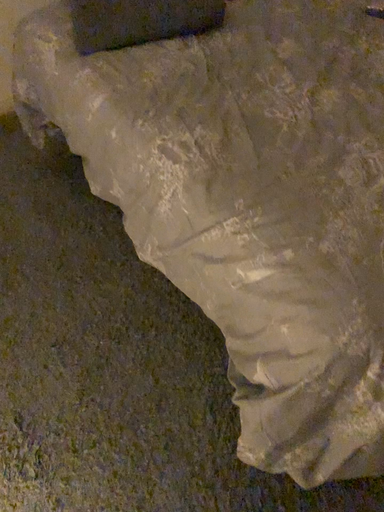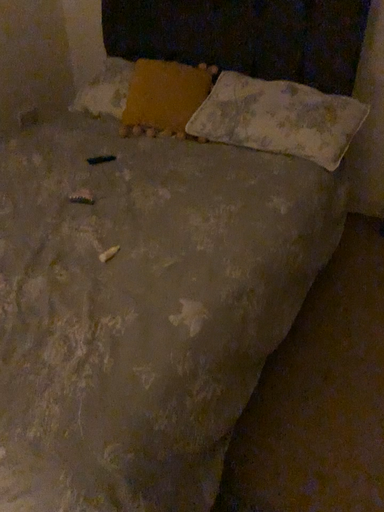
Question: Which way did the camera rotate in the video?

Choices:
 (A) rotated right
 (B) rotated left

Answer: (A)